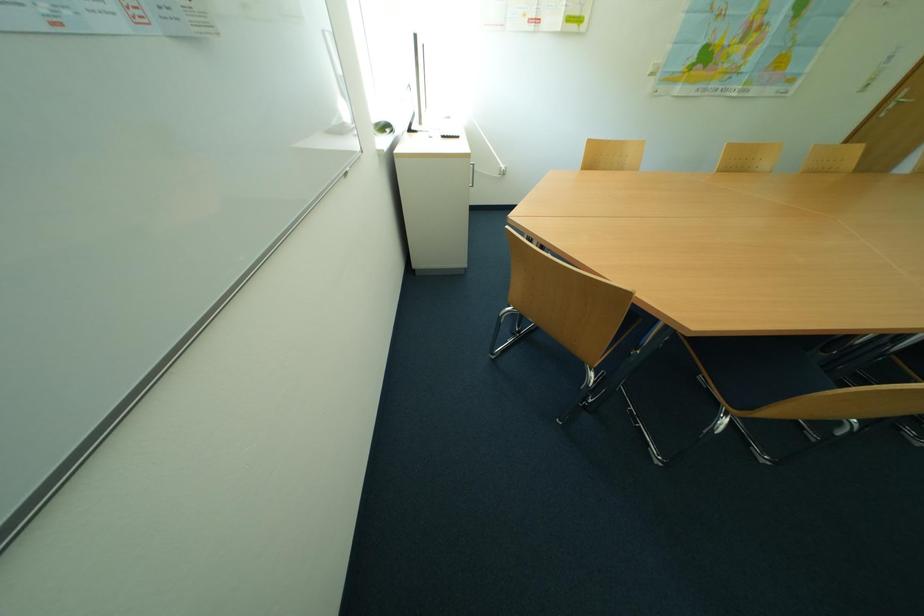
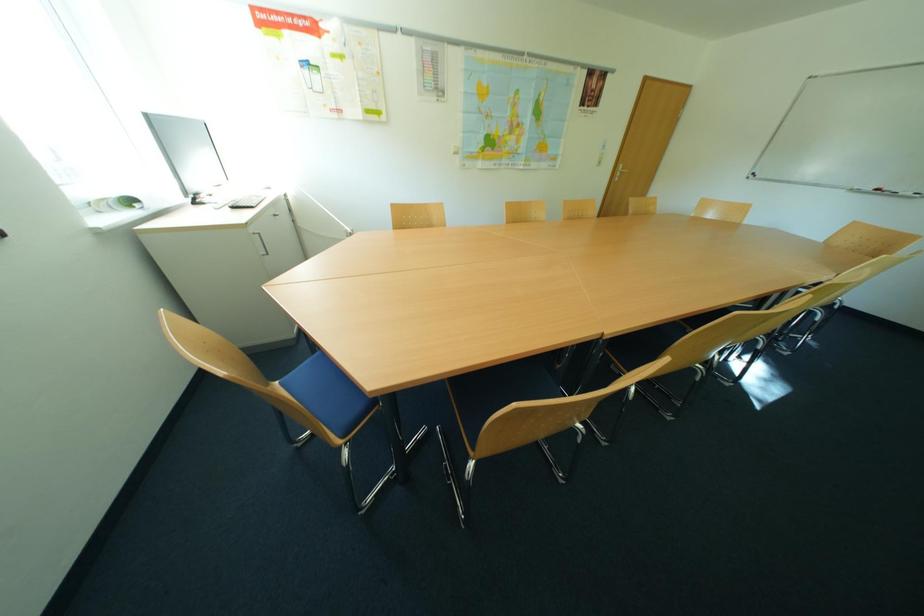
Question: The images are taken continuously from a first-person perspective. In which direction are you moving?

Choices:
 (A) Left
 (B) Right
 (C) Forward
 (D) Backward

Answer: (B)